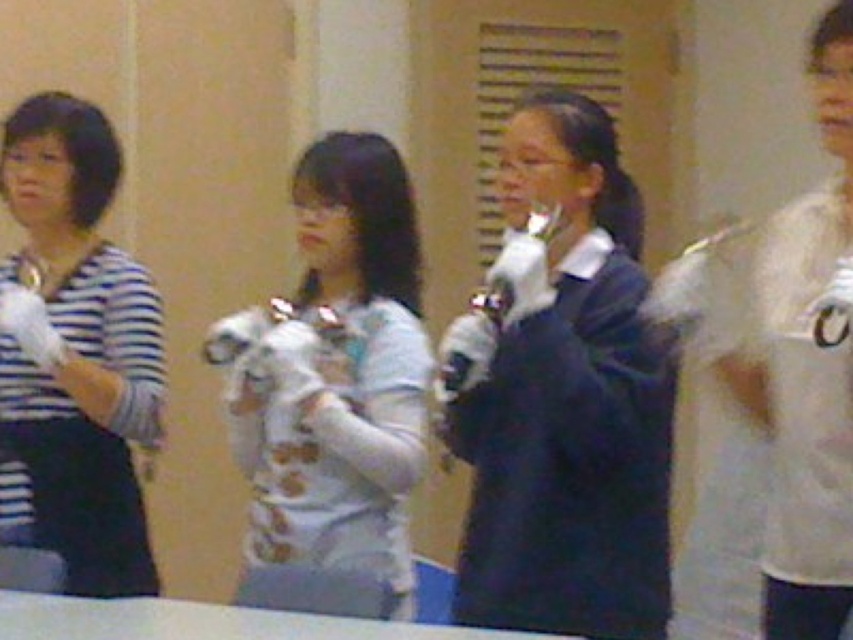
Who is positioned more to the right, white matte shirt at center or striped fabric shirt at left?

white matte shirt at center is more to the right.

Which is more to the left, white matte shirt at center or striped fabric shirt at left?

striped fabric shirt at left is more to the left.

Locate an element on the screen. The width and height of the screenshot is (853, 640). white matte shirt at center is located at coordinates (335, 376).

Which is below, dark blue sweater at center or striped fabric shirt at left?

Positioned lower is dark blue sweater at center.

Who is higher up, dark blue sweater at center or striped fabric shirt at left?

Positioned higher is striped fabric shirt at left.

This screenshot has height=640, width=853. What are the coordinates of `dark blue sweater at center` in the screenshot? It's located at (563, 396).

Where is `dark blue sweater at center`? The width and height of the screenshot is (853, 640). dark blue sweater at center is located at coordinates (563, 396).

Which of these two, dark blue sweater at center or white matte shirt at center, stands shorter?

white matte shirt at center is shorter.

Does dark blue sweater at center appear over white matte shirt at center?

Yes.

The image size is (853, 640). In order to click on dark blue sweater at center in this screenshot , I will do tap(563, 396).

Find the location of a particular element. This screenshot has width=853, height=640. dark blue sweater at center is located at coordinates (563, 396).